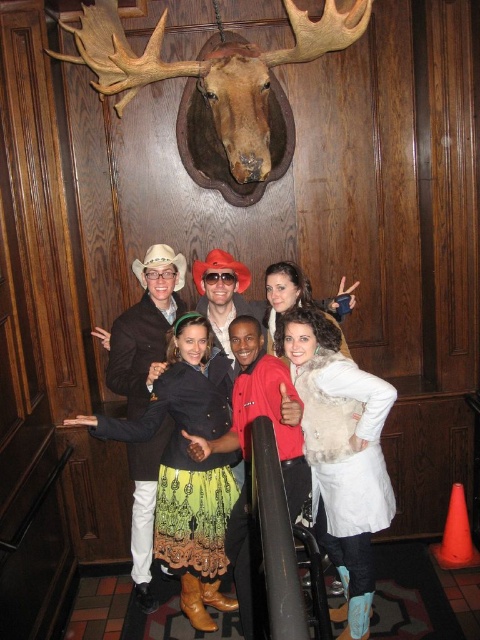
Question: Can you confirm if multicolored woven skirt at center is positioned above brown polished wood reindeer head at upper center?

Choices:
 (A) yes
 (B) no

Answer: (B)

Question: Considering the relative positions of multicolored woven skirt at center and brown polished wood reindeer head at upper center in the image provided, where is multicolored woven skirt at center located with respect to brown polished wood reindeer head at upper center?

Choices:
 (A) right
 (B) left

Answer: (A)

Question: Does multicolored woven skirt at center come in front of green textured skirt at center?

Choices:
 (A) yes
 (B) no

Answer: (A)

Question: Which of the following is the closest to the observer?

Choices:
 (A) (94, 68)
 (B) (108, 365)
 (C) (363, 532)

Answer: (A)

Question: Which of these objects is positioned closest to the multicolored woven skirt at center?

Choices:
 (A) brown polished wood reindeer head at upper center
 (B) green textured skirt at center

Answer: (B)

Question: Which point is closer to the camera?

Choices:
 (A) brown polished wood reindeer head at upper center
 (B) green textured skirt at center

Answer: (A)